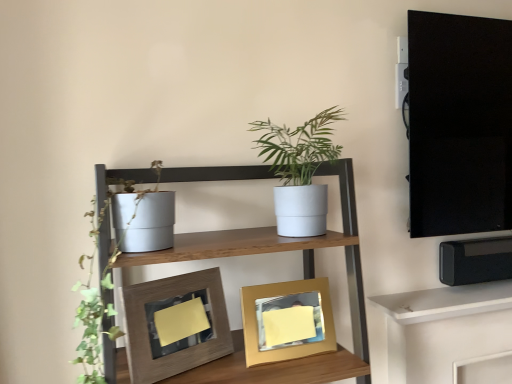
You are a GUI agent. You are given a task and a screenshot of the screen. Output one action in this format:
    pyautogui.click(x=<x>, y=<y>)
    Task: Click on the free space above black glossy tv cabinet at upper right (from a real-world perspective)
    This screenshot has height=384, width=512.
    Given the screenshot: What is the action you would take?
    pyautogui.click(x=467, y=27)